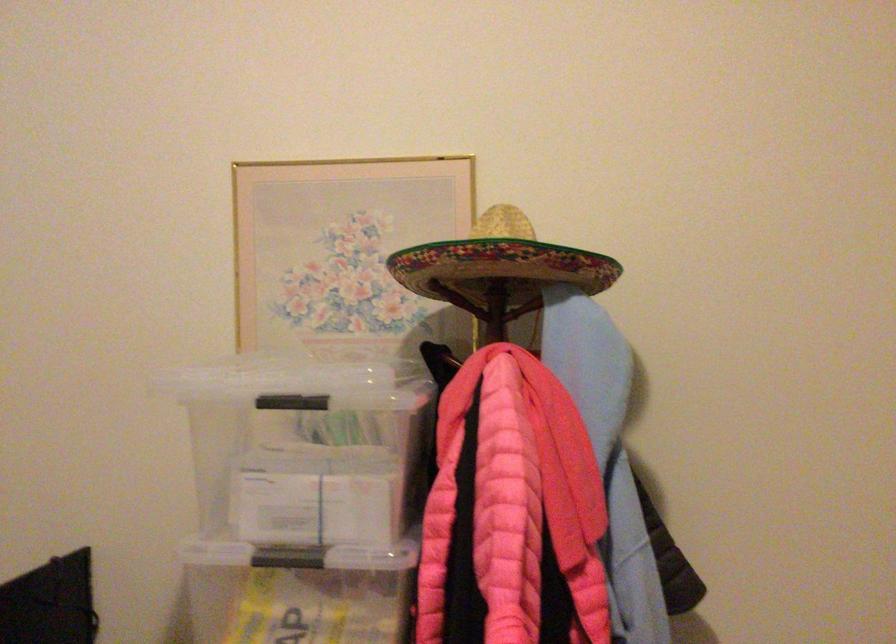
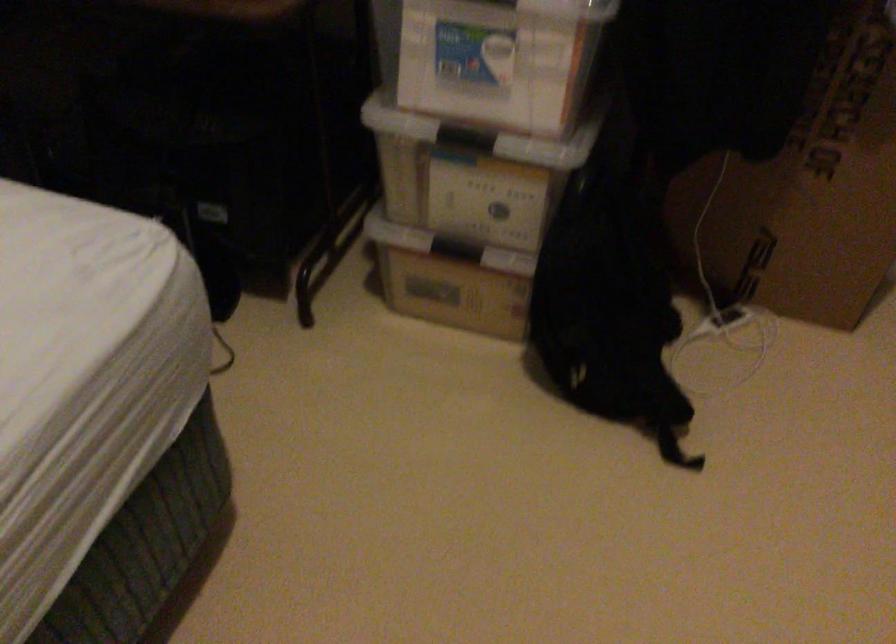
Question: How did the camera likely rotate?

Choices:
 (A) Left
 (B) Right
 (C) Up
 (D) Down

Answer: (D)